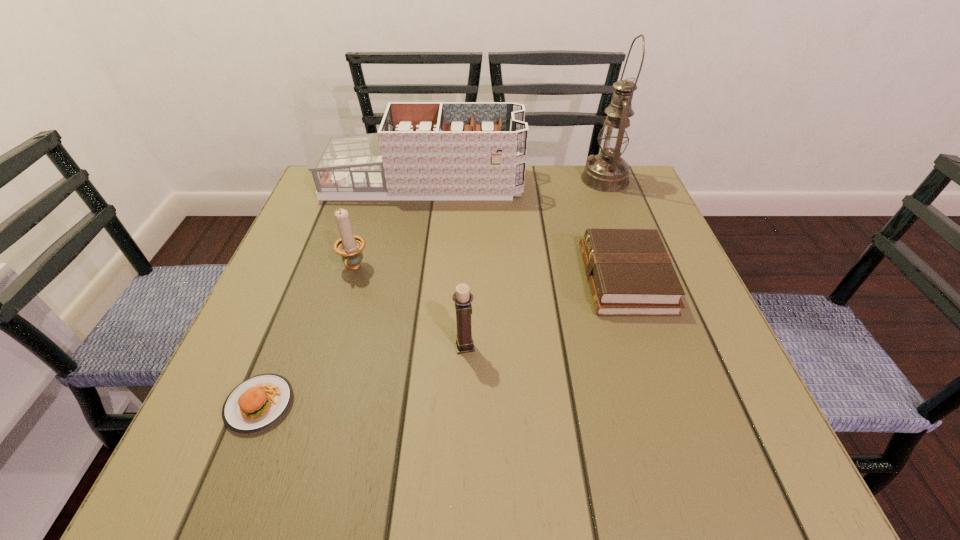
At what (x,y) coordinates should I click in order to perform the action: click on vacant space at the right edge. Please return your answer as a coordinate pair (x, y). Looking at the image, I should click on (674, 361).

In the image, there is a desktop. Where is `free space at the far left corner`? free space at the far left corner is located at coordinates (316, 195).

Where is `vacant region at the far right corner of the desktop`? The width and height of the screenshot is (960, 540). vacant region at the far right corner of the desktop is located at coordinates (644, 217).

Locate an element on the screen. This screenshot has width=960, height=540. unoccupied position between the dollhouse and the nearer candle_holder is located at coordinates (444, 265).

You are a GUI agent. You are given a task and a screenshot of the screen. Output one action in this format:
    pyautogui.click(x=<x>, y=<y>)
    Task: Click on the vacant area that lies between the oil lamp and the second nearest object
    
    Given the screenshot: What is the action you would take?
    pyautogui.click(x=535, y=262)

The height and width of the screenshot is (540, 960). In order to click on vacant area that lies between the fifth shortest object and the food in this screenshot , I will do `click(341, 294)`.

The height and width of the screenshot is (540, 960). In order to click on vacant region between the second shortest object and the fifth shortest object in this screenshot , I will do `click(524, 231)`.

Find the location of a particular element. The height and width of the screenshot is (540, 960). free space that is in between the fifth tallest object and the farther candle_holder is located at coordinates (490, 274).

Find the location of `free point between the fifth shortest object and the second shortest object`. free point between the fifth shortest object and the second shortest object is located at coordinates (524, 231).

Find the location of a particular element. Image resolution: width=960 pixels, height=540 pixels. vacant area that lies between the oil lamp and the left candle_holder is located at coordinates (480, 224).